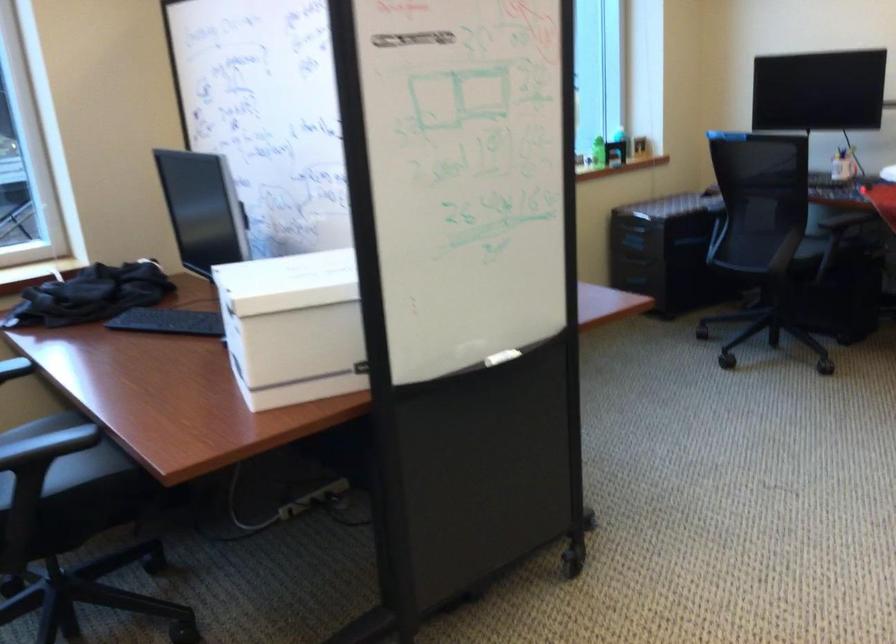
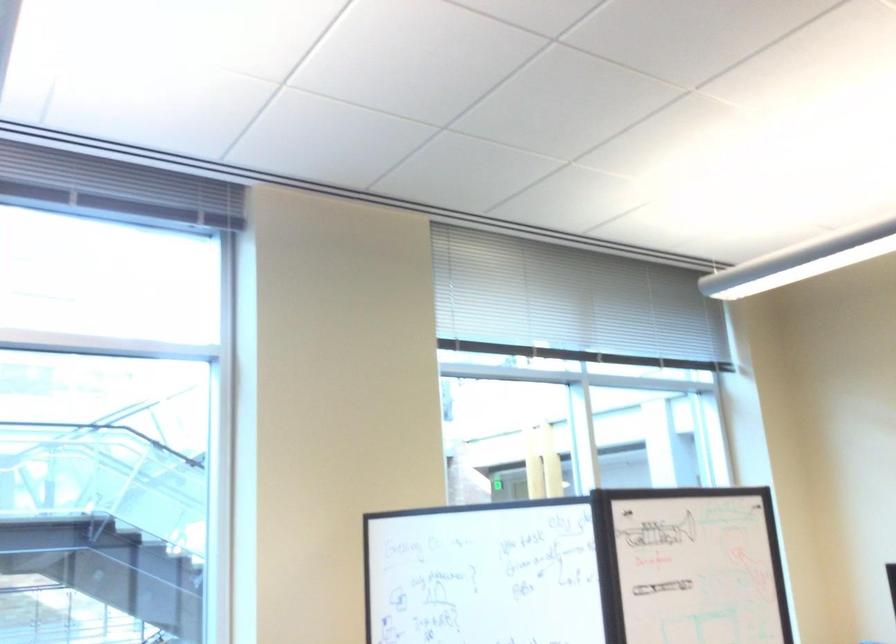
Question: Based on the continuous images, in which direction is the camera rotating? Reply with the corresponding letter.

Choices:
 (A) Left
 (B) Right
 (C) Up
 (D) Down

Answer: (C)